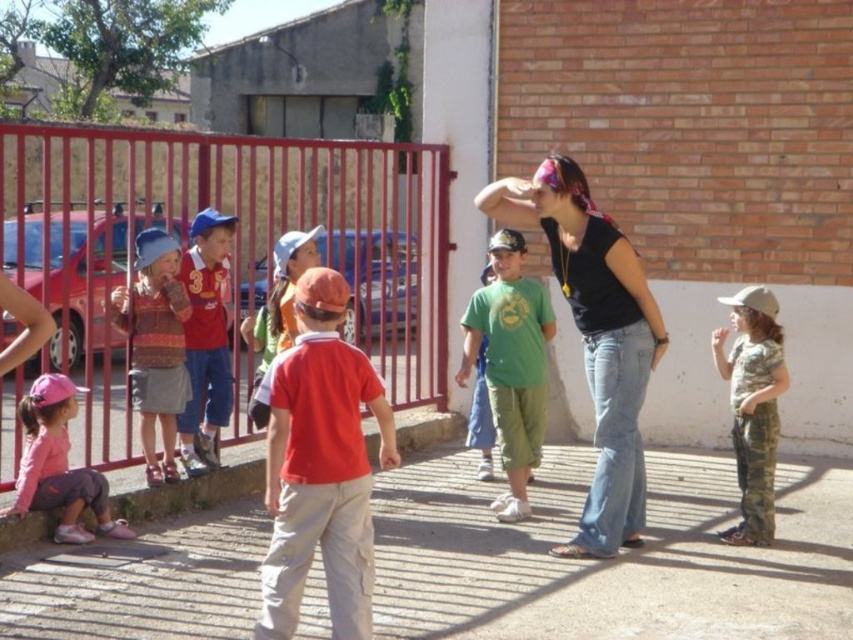
You are a photographer trying to capture a photo of the striped sweater at left without including the red metal fence at left in the frame. Based on their sizes, is this possible?

The red metal fence at left is much taller than the striped sweater at left, so it might block the view. You might need to move closer to the striped sweater at left or adjust your angle to exclude the fence.

You are standing in the schoolyard and see two points marked in the scene. The first point is at coordinates point [621,260] and the second is at point [3,513]. Which point is closer to you?

Point [621,260] is closer to the camera than point [3,513], so the first point is closer to you.

You are a photographer trying to capture a clear photo of the matte red shirt at center without the striped sweater at left blocking it. Based on the scene, what adjustment should you make to your camera angle?

The striped sweater at left is in front of the matte red shirt at center, so you should adjust your camera angle to move it behind the striped sweater at left to ensure the matte red shirt at center is visible.